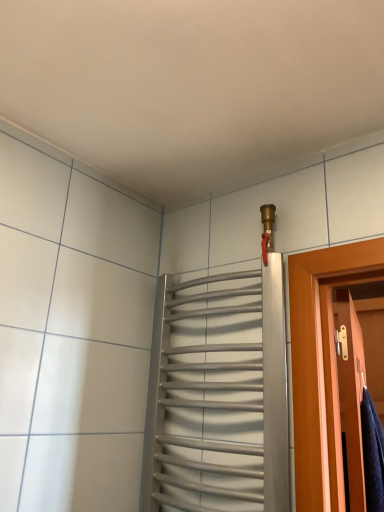
Question: Considering the positions of wooden door at right and silver metallic towel rack at upper center in the image, is wooden door at right taller or shorter than silver metallic towel rack at upper center?

Choices:
 (A) tall
 (B) short

Answer: (B)

Question: Looking at their shapes, would you say wooden door at right is wider or thinner than silver metallic towel rack at upper center?

Choices:
 (A) thin
 (B) wide

Answer: (A)

Question: From a real-world perspective, is wooden door at right above or below silver metallic towel rack at upper center?

Choices:
 (A) above
 (B) below

Answer: (B)

Question: Considering the positions of silver metallic towel rack at upper center and wooden door at right in the image, is silver metallic towel rack at upper center wider or thinner than wooden door at right?

Choices:
 (A) wide
 (B) thin

Answer: (A)

Question: In terms of height, does silver metallic towel rack at upper center look taller or shorter compared to wooden door at right?

Choices:
 (A) short
 (B) tall

Answer: (B)

Question: Do you think silver metallic towel rack at upper center is within wooden door at right, or outside of it?

Choices:
 (A) inside
 (B) outside

Answer: (B)

Question: Based on their positions, is silver metallic towel rack at upper center located to the left or right of wooden door at right?

Choices:
 (A) left
 (B) right

Answer: (A)